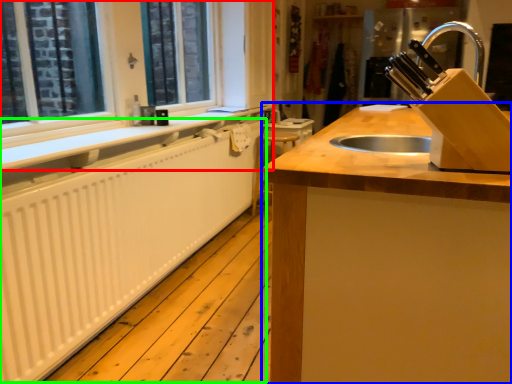
Question: Considering the real-world distances, which object is closest to window frame (highlighted by a red box)? countertop (highlighted by a blue box) or radiator (highlighted by a green box).

Choices:
 (A) countertop
 (B) radiator

Answer: (B)